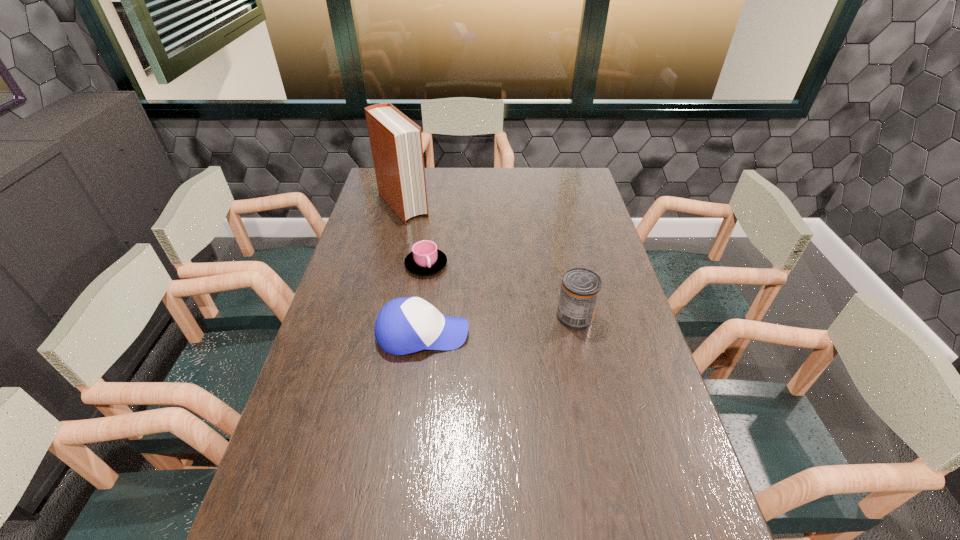
The image size is (960, 540). I want to click on vacant area that lies between the tallest object and the rightmost object, so point(489,261).

At what (x,y) coordinates should I click in order to perform the action: click on free space between the shortest object and the hardback book. Please return your answer as a coordinate pair (x, y). Looking at the image, I should click on (415, 235).

I want to click on free area in between the can and the cup, so click(x=500, y=291).

I want to click on object identified as the closest to the second tallest object, so click(x=404, y=325).

Where is `object identified as the third closest to the farthest object`? This screenshot has height=540, width=960. object identified as the third closest to the farthest object is located at coordinates (580, 289).